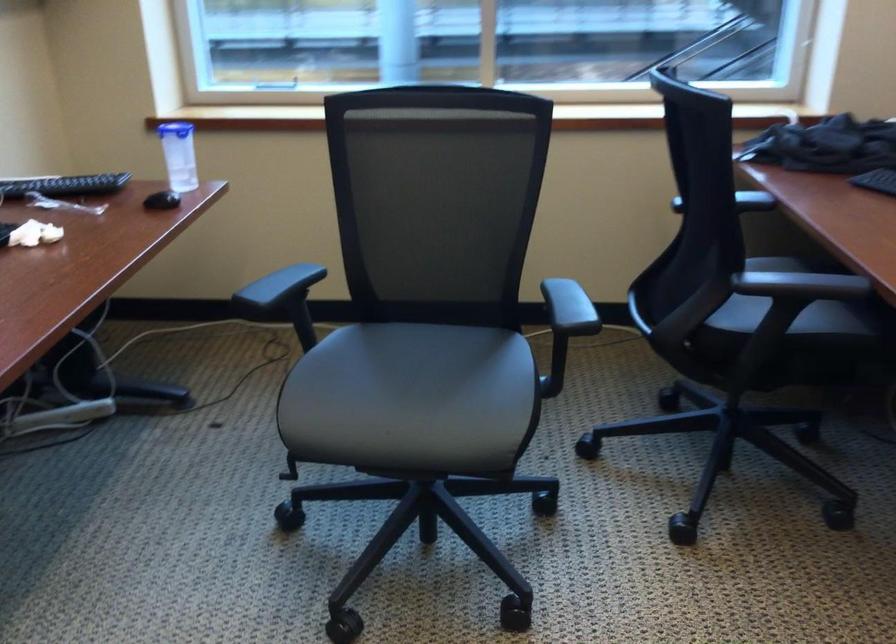
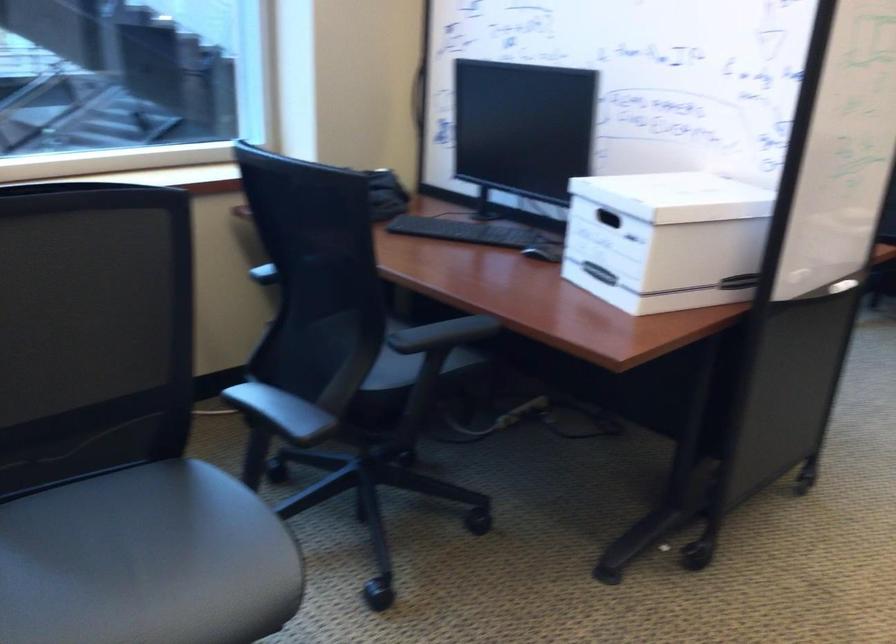
The point at (423, 383) is marked in the first image. Where is the corresponding point in the second image?

(145, 561)